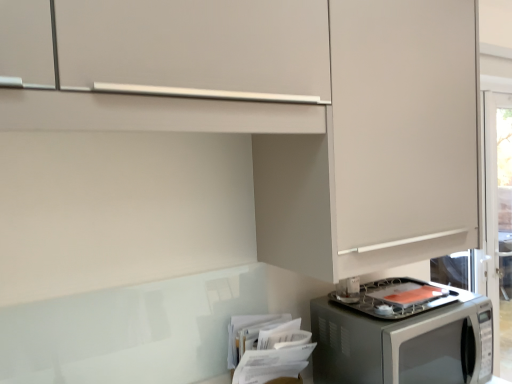
Locate an element on the screen. satin silver microwave at lower right is located at coordinates (404, 344).

The height and width of the screenshot is (384, 512). Describe the element at coordinates (404, 344) in the screenshot. I see `satin silver microwave at lower right` at that location.

Measure the distance between satin silver microwave at lower right and camera.

satin silver microwave at lower right and camera are 3.56 feet apart from each other.

This screenshot has height=384, width=512. What do you see at coordinates (281, 109) in the screenshot?
I see `matte white cabinet at upper right` at bounding box center [281, 109].

In order to click on matte white cabinet at upper right in this screenshot , I will do `click(281, 109)`.

At what (x,y) coordinates should I click in order to perform the action: click on satin silver microwave at lower right. Please return your answer as a coordinate pair (x, y). Looking at the image, I should click on (404, 344).

Is matte white cabinet at upper right to the left or to the right of satin silver microwave at lower right in the image?

From the image, it's evident that matte white cabinet at upper right is to the left of satin silver microwave at lower right.

Which object is closer to the camera taking this photo, matte white cabinet at upper right or satin silver microwave at lower right?

Positioned in front is matte white cabinet at upper right.

Which point is more forward, (411, 18) or (393, 367)?

Point (393, 367)

From the image's perspective, relative to satin silver microwave at lower right, is matte white cabinet at upper right above or below?

Based on their image positions, matte white cabinet at upper right is located above satin silver microwave at lower right.

From a real-world perspective, between matte white cabinet at upper right and satin silver microwave at lower right, who is vertically higher?

matte white cabinet at upper right, from a real-world perspective.

Between matte white cabinet at upper right and satin silver microwave at lower right, which one has smaller width?

matte white cabinet at upper right.

Considering the sizes of matte white cabinet at upper right and satin silver microwave at lower right in the image, is matte white cabinet at upper right taller or shorter than satin silver microwave at lower right?

matte white cabinet at upper right is taller than satin silver microwave at lower right.

Can you confirm if matte white cabinet at upper right is bigger than satin silver microwave at lower right?

Yes, matte white cabinet at upper right is bigger than satin silver microwave at lower right.

Can satin silver microwave at lower right be found inside matte white cabinet at upper right?

No, matte white cabinet at upper right does not contain satin silver microwave at lower right.

Are matte white cabinet at upper right and satin silver microwave at lower right beside each other?

No, matte white cabinet at upper right is not beside satin silver microwave at lower right.

Is matte white cabinet at upper right oriented towards satin silver microwave at lower right?

No, matte white cabinet at upper right is not turned towards satin silver microwave at lower right.

What's the angular difference between matte white cabinet at upper right and satin silver microwave at lower right's facing directions?

They differ by 1.55 degrees in their facing directions.

How far apart are matte white cabinet at upper right and satin silver microwave at lower right?

A distance of 16.71 inches exists between matte white cabinet at upper right and satin silver microwave at lower right.

Locate an element on the screen. This screenshot has height=384, width=512. cabinetry on the left of satin silver microwave at lower right is located at coordinates (281, 109).

Is satin silver microwave at lower right to the left or to the right of matte white cabinet at upper right in the image?

satin silver microwave at lower right is positioned on matte white cabinet at upper right's right side.

Is satin silver microwave at lower right in front of or behind matte white cabinet at upper right in the image?

In the image, satin silver microwave at lower right appears behind matte white cabinet at upper right.

Between point (332, 313) and point (332, 228), which one is positioned behind?

The point (332, 313) is farther from the camera.

From the image's perspective, which is above, satin silver microwave at lower right or matte white cabinet at upper right?

matte white cabinet at upper right, from the image's perspective.

Based on the photo, from a real-world perspective, is satin silver microwave at lower right under matte white cabinet at upper right?

Indeed, from a real-world perspective, satin silver microwave at lower right is positioned beneath matte white cabinet at upper right.

Considering the sizes of objects satin silver microwave at lower right and matte white cabinet at upper right in the image provided, who is wider, satin silver microwave at lower right or matte white cabinet at upper right?

With larger width is satin silver microwave at lower right.

Is satin silver microwave at lower right taller or shorter than matte white cabinet at upper right?

In the image, satin silver microwave at lower right appears to be shorter than matte white cabinet at upper right.

Looking at the image, does satin silver microwave at lower right seem bigger or smaller compared to matte white cabinet at upper right?

In the image, satin silver microwave at lower right appears to be smaller than matte white cabinet at upper right.

Is satin silver microwave at lower right completely or partially outside of matte white cabinet at upper right?

satin silver microwave at lower right is positioned outside matte white cabinet at upper right.

Based on the photo, are satin silver microwave at lower right and matte white cabinet at upper right far apart?

No, satin silver microwave at lower right is not far away from matte white cabinet at upper right.

Is matte white cabinet at upper right at the back of satin silver microwave at lower right?

No, satin silver microwave at lower right's orientation is not away from matte white cabinet at upper right.

How different are the orientations of satin silver microwave at lower right and matte white cabinet at upper right in degrees?

They differ by 1.55 degrees in their facing directions.

How distant is satin silver microwave at lower right from matte white cabinet at upper right?

16.71 inches.

Where is `home appliance that is on the right side of matte white cabinet at upper right`? home appliance that is on the right side of matte white cabinet at upper right is located at coordinates (404, 344).

Find the location of a particular element. The image size is (512, 384). home appliance that appears below the matte white cabinet at upper right (from the image's perspective) is located at coordinates (404, 344).

Locate an element on the screen. The height and width of the screenshot is (384, 512). home appliance below the matte white cabinet at upper right (from a real-world perspective) is located at coordinates (404, 344).